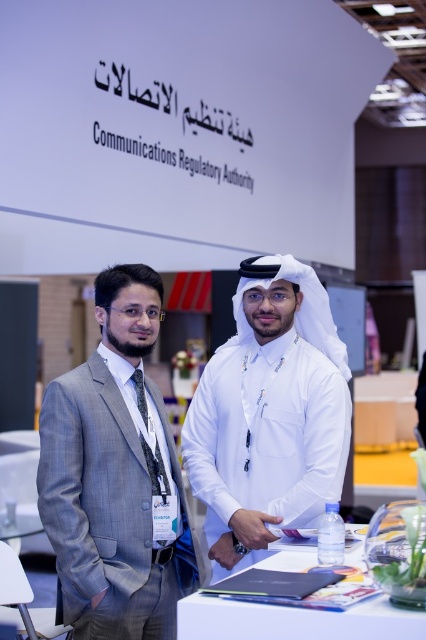
Is gray suit at left wider than white matte shirt at center?

Incorrect, gray suit at left's width does not surpass white matte shirt at center's.

What are the coordinates of `gray suit at left` in the screenshot? It's located at (115, 476).